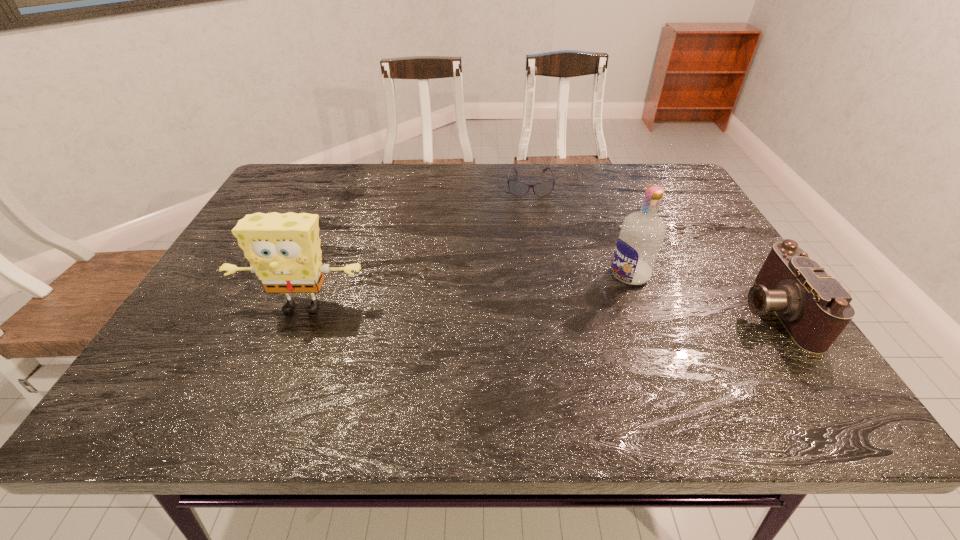
Where is `free space located on the lenses of the second object from left to right`? Image resolution: width=960 pixels, height=540 pixels. free space located on the lenses of the second object from left to right is located at coordinates (532, 222).

Find the location of `free space located 0.370m on the lenses of the second object from left to right`. free space located 0.370m on the lenses of the second object from left to right is located at coordinates (536, 282).

Find the location of `vacant region located 0.260m on the lenses of the second object from left to right`. vacant region located 0.260m on the lenses of the second object from left to right is located at coordinates (534, 253).

The height and width of the screenshot is (540, 960). What are the coordinates of `vacant space located 0.250m on the label of the second object from right to left` in the screenshot? It's located at (529, 322).

The height and width of the screenshot is (540, 960). I want to click on vacant space located 0.360m on the label of the second object from right to left, so click(486, 342).

Where is `vacant position located 0.240m on the label of the second object from right to left`? The width and height of the screenshot is (960, 540). vacant position located 0.240m on the label of the second object from right to left is located at coordinates (533, 320).

Image resolution: width=960 pixels, height=540 pixels. I want to click on object located in the far edge section of the desktop, so click(518, 188).

Identify the location of object present at the near edge. The width and height of the screenshot is (960, 540). (814, 308).

The width and height of the screenshot is (960, 540). I want to click on object that is at the left edge, so click(284, 251).

Locate an element on the screen. object that is at the right edge is located at coordinates (814, 308).